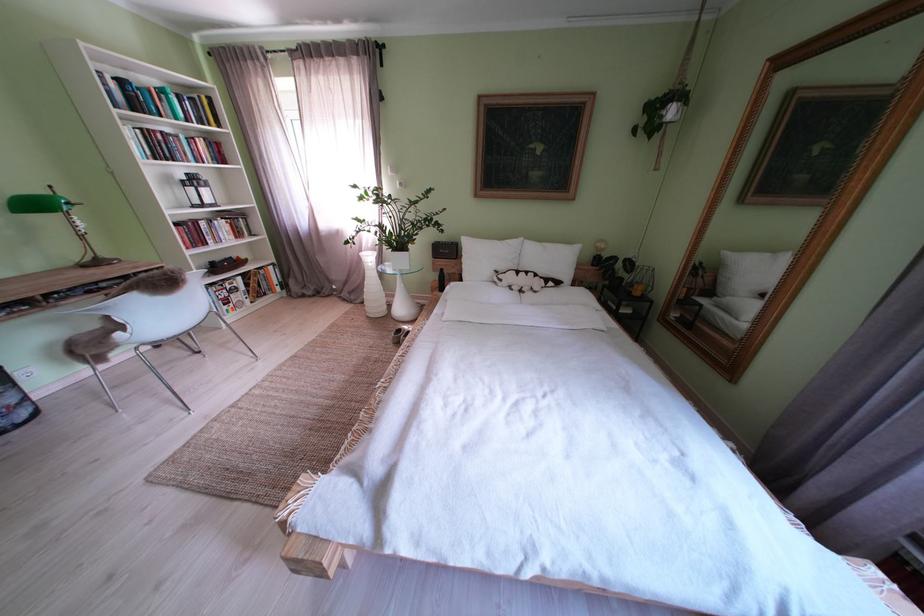
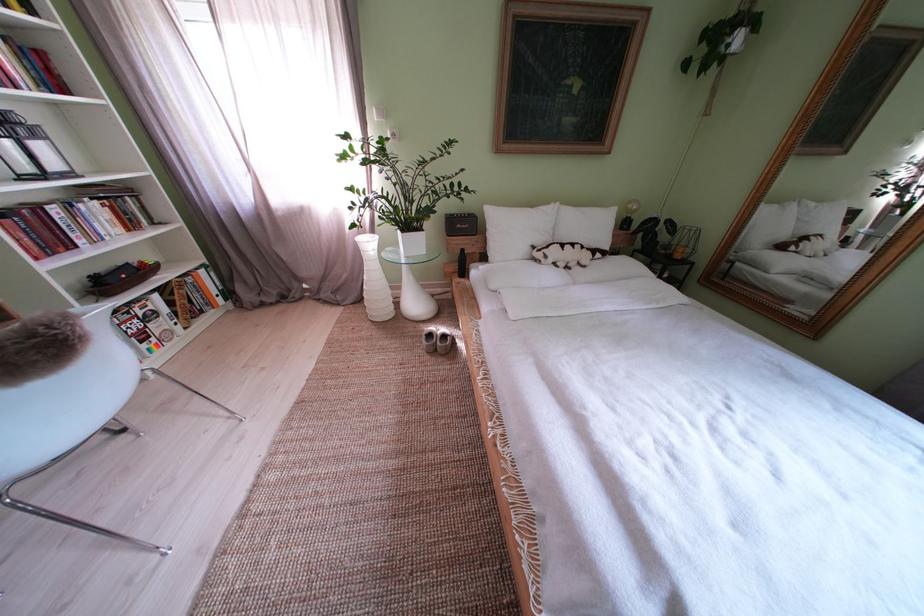
Question: Based on the continuous images, in which direction is the camera rotating? Reply with the corresponding letter.

Choices:
 (A) Left
 (B) Right
 (C) Up
 (D) Down

Answer: (B)